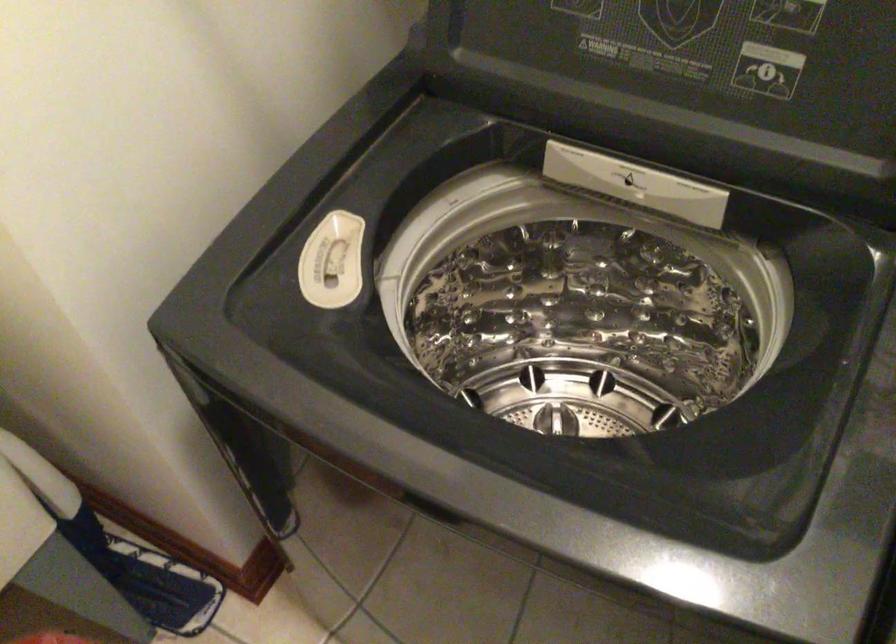
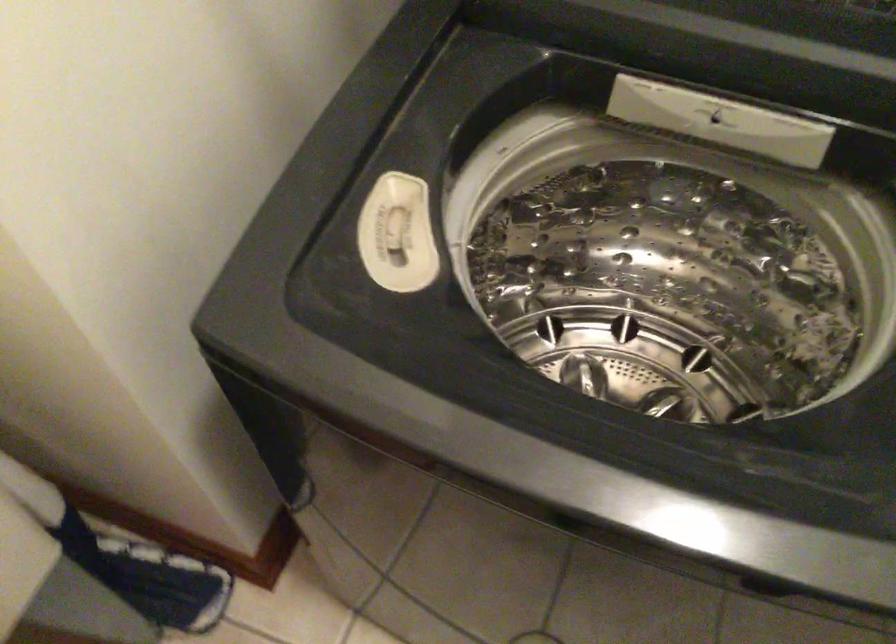
The point at [132,564] is marked in the first image. Where is the corresponding point in the second image?

(125, 560)